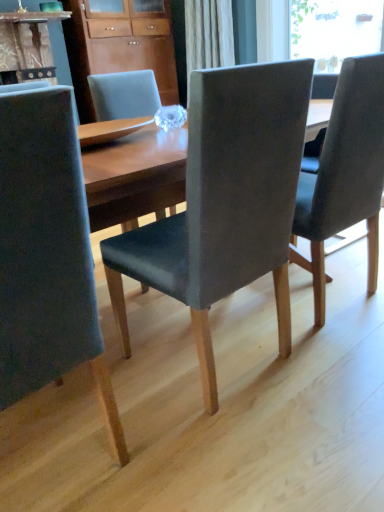
Identify the location of empty space that is in between matte gray chair at center, acting as the second chair starting from the left, and matte gray chair at left, arranged as the 1th chair when viewed from the left. (144, 406).